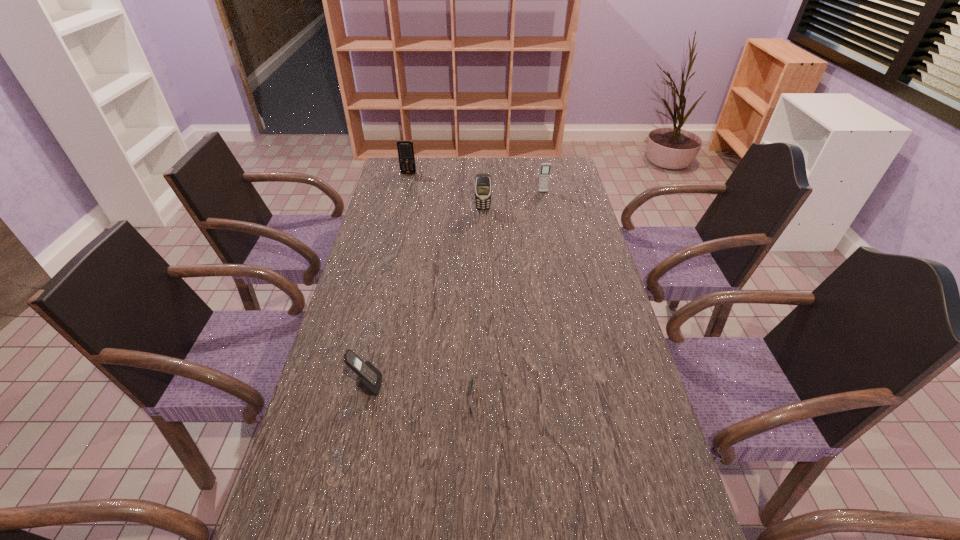
The image size is (960, 540). Identify the location of the farthest cellular telephone. (405, 148).

I want to click on the second nearest cellular telephone, so click(483, 187).

Identify the location of the third nearest object. (483, 187).

Image resolution: width=960 pixels, height=540 pixels. Identify the location of the second farthest object. (545, 167).

At what (x,y) coordinates should I click in order to perform the action: click on the third nearest cellular telephone. Please return your answer as a coordinate pair (x, y). This screenshot has width=960, height=540. Looking at the image, I should click on (545, 167).

This screenshot has height=540, width=960. I want to click on the nearest cellular telephone, so click(369, 379).

Identify the location of the shortest object. (471, 383).

This screenshot has width=960, height=540. In order to click on free location located 0.130m on the screen of the farthest object in this screenshot , I will do `click(404, 191)`.

The image size is (960, 540). Identify the location of free space located 0.290m on the front face of the second cellular telephone from right to left. (484, 261).

At what (x,y) coordinates should I click in order to perform the action: click on vacant space located 0.280m on the front-facing side of the rightmost cellular telephone. Please return your answer as a coordinate pair (x, y). The width and height of the screenshot is (960, 540). Looking at the image, I should click on pyautogui.click(x=552, y=236).